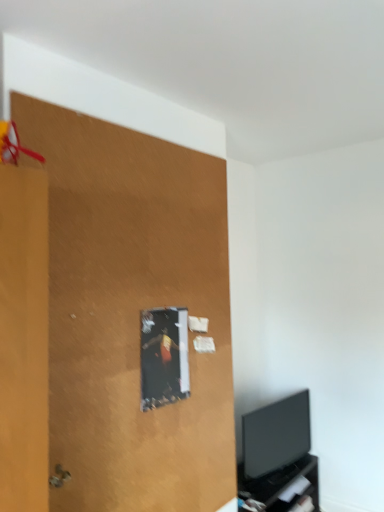
Question: Based on their sizes in the image, would you say black glossy tv at lower right is bigger or smaller than matte brown plywood at upper left?

Choices:
 (A) big
 (B) small

Answer: (B)

Question: In terms of height, does black glossy tv at lower right look taller or shorter compared to matte brown plywood at upper left?

Choices:
 (A) short
 (B) tall

Answer: (A)

Question: Estimate the real-world distances between objects in this image. Which object is farther from the matte brown plywood at upper left?

Choices:
 (A) black glossy tv at lower right
 (B) black matte tv cabinet at lower right

Answer: (B)

Question: Which object is the farthest from the black glossy tv at lower right?

Choices:
 (A) black matte tv cabinet at lower right
 (B) matte brown plywood at upper left

Answer: (B)